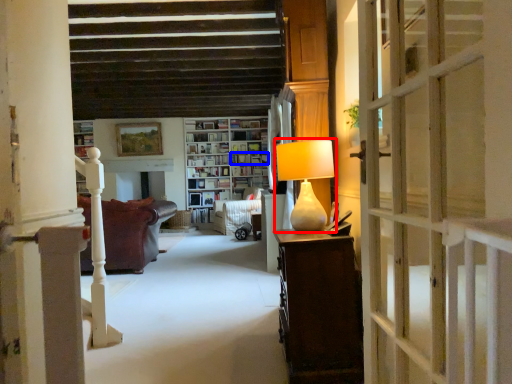
Question: Among these objects, which one is nearest to the camera, table lamp (highlighted by a red box) or shelf (highlighted by a blue box)?

Choices:
 (A) table lamp
 (B) shelf

Answer: (A)